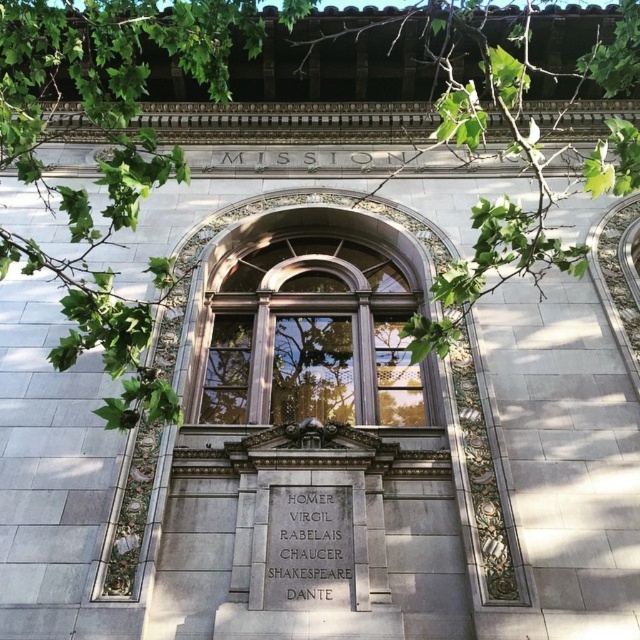
You are standing in front of the building facade and want to touch both the wooden window at center and the gray stone plaque at center. Which object would you need to reach further to touch first?

The gray stone plaque at center is behind the wooden window at center, so you would need to reach further to touch the gray stone plaque at center first because it is farther away from you compared to the wooden window at center.

You are standing at the base of the building depicted in the image. You want to place a ladder to reach both the green leafy branches at upper center and the gray stone plaque at center. Given that the ladder you have is 30 meters long, will it be sufficient to reach both objects?

The distance between the green leafy branches at upper center and the gray stone plaque at center is 29.82 meters. Since the ladder is 30 meters long, it will be sufficient to reach both objects as the distance between them is less than the ladder length.

You are standing in front of the building facade and want to determine the relative positions of two points marked on the image. Which point is closer to you, point (209, 412) or point (275, 563)?

Point (209, 412) is closer to you because it is further to the viewer than point (275, 563).